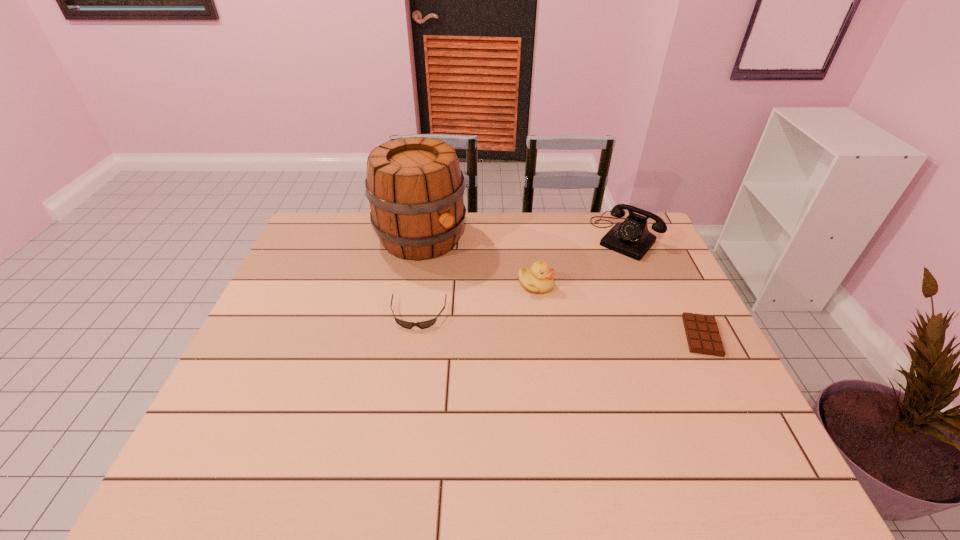
The height and width of the screenshot is (540, 960). What are the coordinates of `telephone that is at the right edge` in the screenshot? It's located at (631, 237).

You are a GUI agent. You are given a task and a screenshot of the screen. Output one action in this format:
    pyautogui.click(x=<x>, y=<y>)
    Task: Click on the object at the far right corner
    The width and height of the screenshot is (960, 540).
    Given the screenshot: What is the action you would take?
    pyautogui.click(x=631, y=237)

Image resolution: width=960 pixels, height=540 pixels. In the image, there is a desktop. Identify the location of vacant space at the far edge. (467, 241).

In the image, there is a desktop. At what (x,y) coordinates should I click in order to perform the action: click on vacant space at the near edge. Please return your answer as a coordinate pair (x, y). Image resolution: width=960 pixels, height=540 pixels. Looking at the image, I should click on coord(443,428).

In the image, there is a desktop. In order to click on vacant region at the left edge in this screenshot , I will do (312, 279).

Identify the location of vacant space at the right edge. (650, 294).

In the image, there is a desktop. Identify the location of vacant space at the far left corner. (349, 231).

The height and width of the screenshot is (540, 960). I want to click on free space at the far right corner of the desktop, so click(x=641, y=215).

Locate an element on the screen. vacant region between the third nearest object and the second shortest object is located at coordinates click(477, 300).

I want to click on vacant space that is in between the telephone and the shortest object, so click(664, 287).